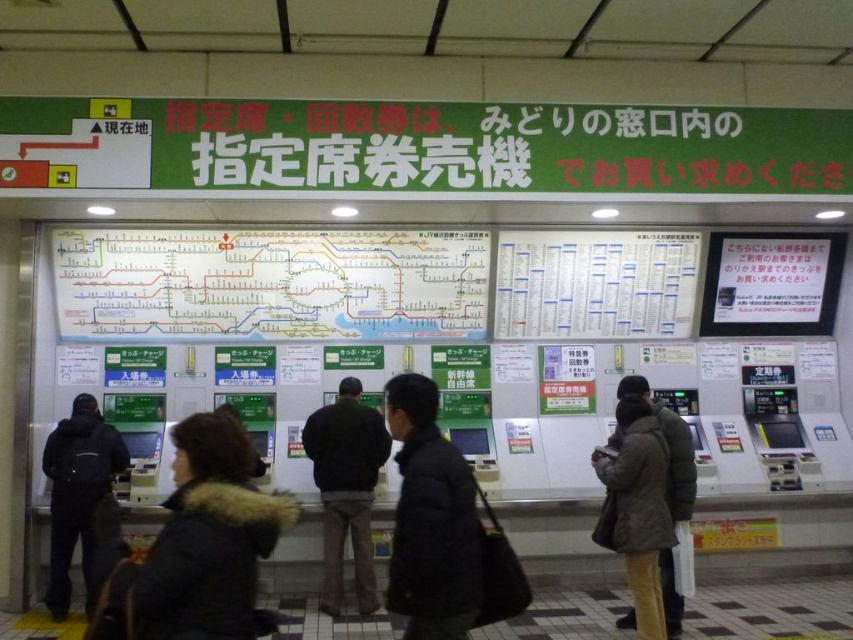
Question: Which of the following is the closest to the observer?

Choices:
 (A) dark gray fur-lined coat at center
 (B) dark brown jacket at lower right
 (C) black matte jacket at center

Answer: (A)

Question: Is dark gray fur-lined coat at center positioned behind black matte jacket at center?

Choices:
 (A) yes
 (B) no

Answer: (B)

Question: Does dark gray fur-lined coat at center have a greater width compared to dark brown jacket at center?

Choices:
 (A) yes
 (B) no

Answer: (B)

Question: Considering the real-world distances, which object is closest to the dark brown jacket at center?

Choices:
 (A) dark gray fur-lined coat at center
 (B) white paper map at center
 (C) black matte jacket at center

Answer: (B)

Question: Which point appears closest to the camera in this image?

Choices:
 (A) (624, 492)
 (B) (129, 307)
 (C) (332, 493)

Answer: (A)

Question: Can you confirm if white paper map at center is bigger than black matte jacket at center?

Choices:
 (A) no
 (B) yes

Answer: (B)